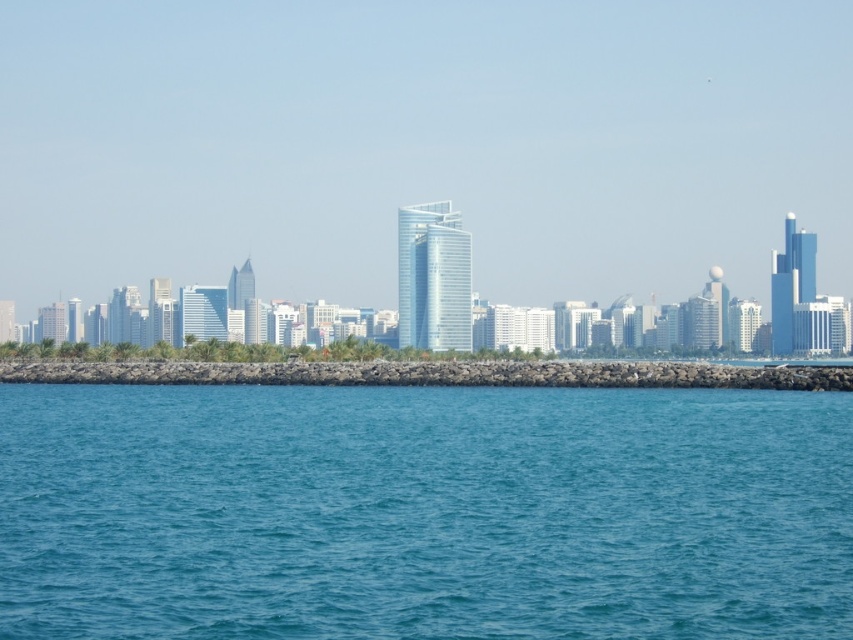
Question: Is blue water at center positioned at the back of rocky barrier at center?

Choices:
 (A) no
 (B) yes

Answer: (A)

Question: Which object appears farthest from the camera in this image?

Choices:
 (A) blue water at center
 (B) rocky barrier at center

Answer: (B)

Question: Which object appears closest to the camera in this image?

Choices:
 (A) blue water at center
 (B) rocky barrier at center

Answer: (A)

Question: Is blue water at center thinner than rocky barrier at center?

Choices:
 (A) no
 (B) yes

Answer: (B)

Question: Which of the following is the closest to the observer?

Choices:
 (A) (7, 528)
 (B) (276, 371)

Answer: (A)

Question: Does blue water at center appear on the left side of rocky barrier at center?

Choices:
 (A) no
 (B) yes

Answer: (B)